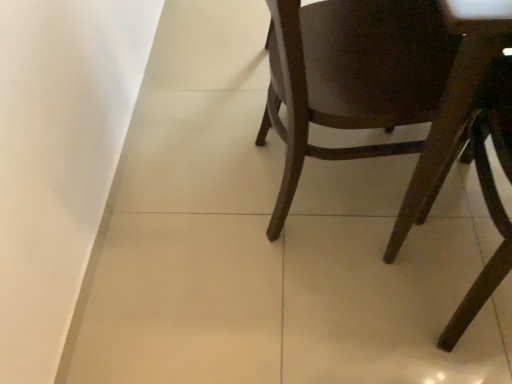
What are the coordinates of `free spot to the left of dark wood chair at lower right, the 2th chair in the left-to-right sequence` in the screenshot? It's located at (367, 300).